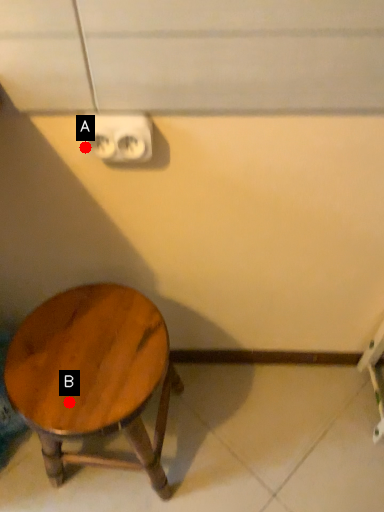
Question: Two points are circled on the image, labeled by A and B beside each circle. Which point is closer to the camera taking this photo?

Choices:
 (A) A is closer
 (B) B is closer

Answer: (A)